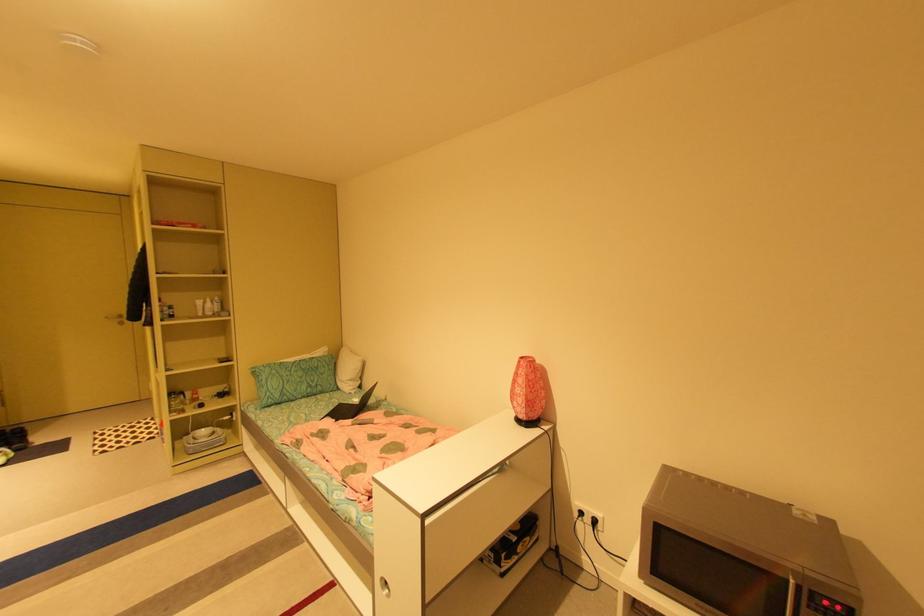
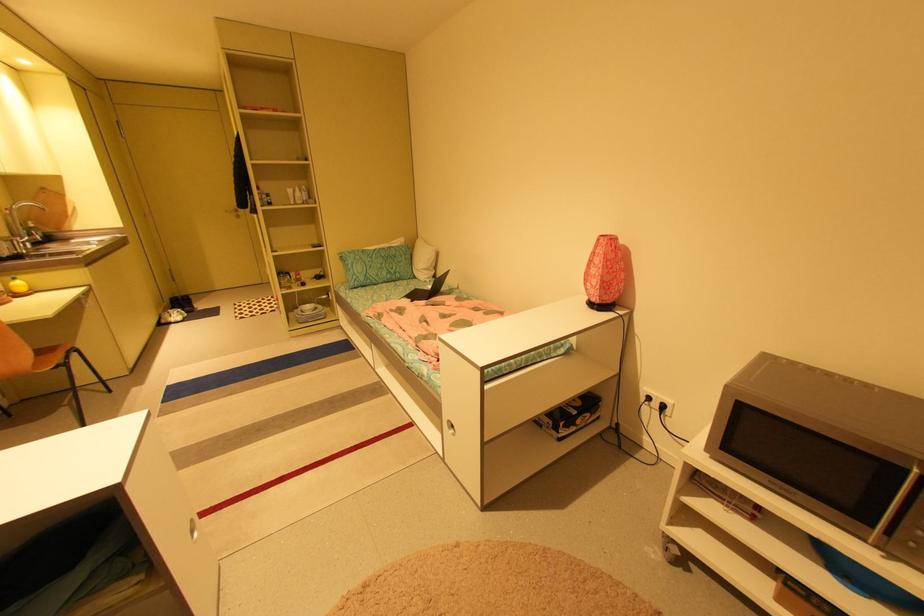
Locate, in the second image, the point that corresponds to the point at 113,318 in the first image.

(232, 211)